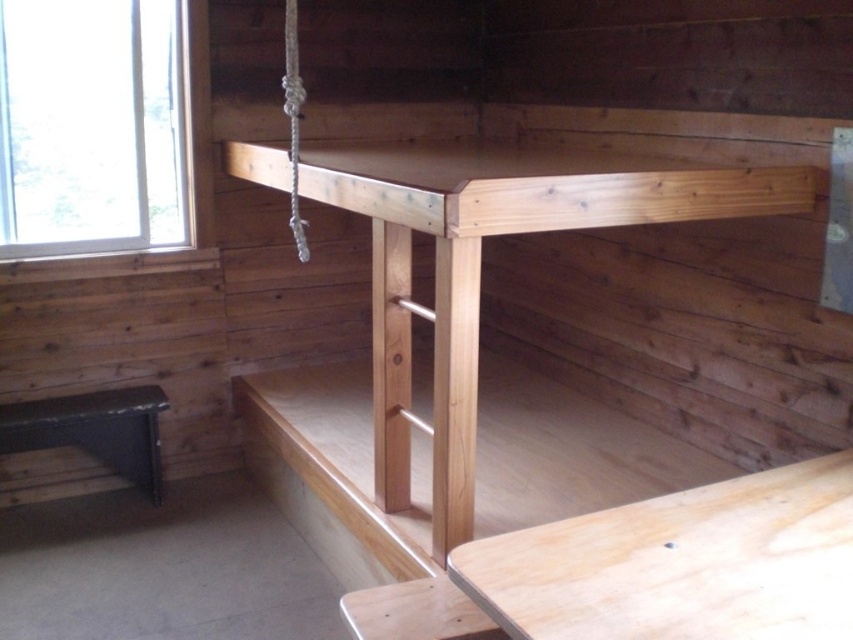
You are standing at the entrance of the cabin and want to place a new rug in the center of the room. The natural wood bunk bed at center is currently occupying the central area. Is there enough space to place the rug without overlapping the bunk bed?

The natural wood bunk bed at center is located at point (479,269), which indicates it is already at the center of the room. Therefore, placing a rug in the center would overlap with the bunk bed, so there isn not enough space.

You are standing in the wooden cabin described. Where is the natural wood bunk bed at center located in terms of its 2D coordinates?

The natural wood bunk bed at center is located at the 2D coordinates point (479, 269).